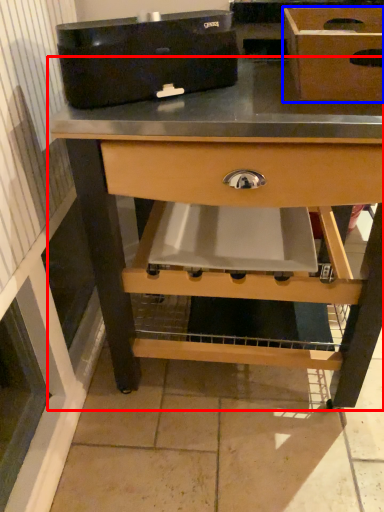
Question: Among these objects, which one is nearest to the camera, table (highlighted by a red box) or box (highlighted by a blue box)?

Choices:
 (A) table
 (B) box

Answer: (B)